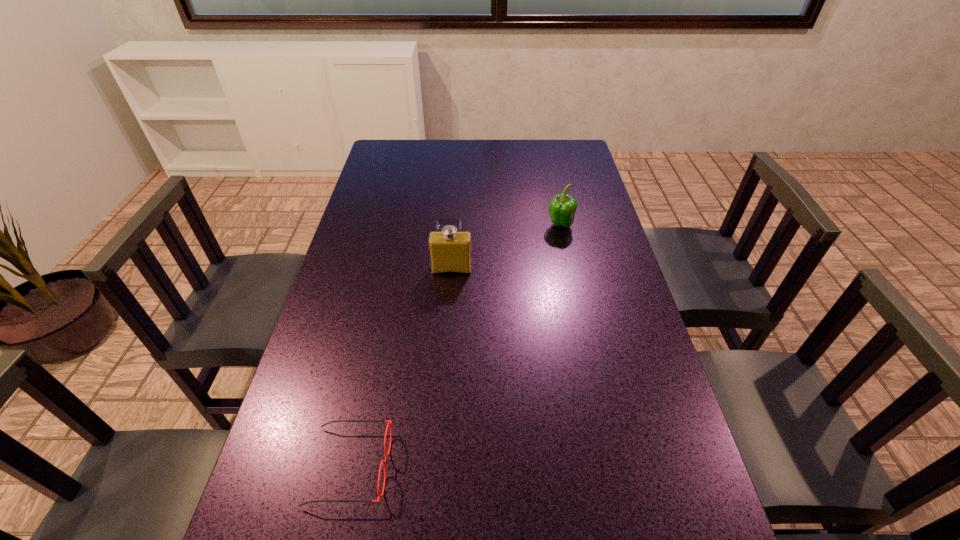
I want to click on free space between the perfume and the rightmost object, so click(x=506, y=247).

Where is `vacant area that lies between the second shortest object and the tallest object`? This screenshot has width=960, height=540. vacant area that lies between the second shortest object and the tallest object is located at coordinates (506, 247).

I want to click on vacant area that lies between the second object from right to left and the nearest object, so click(400, 368).

At what (x,y) coordinates should I click in order to perform the action: click on vacant space that is in between the tallest object and the bell pepper. Please return your answer as a coordinate pair (x, y). Looking at the image, I should click on (506, 247).

You are a GUI agent. You are given a task and a screenshot of the screen. Output one action in this format:
    pyautogui.click(x=<x>, y=<y>)
    Task: Click on the vacant region between the shortest object and the second object from left to right
    This screenshot has height=540, width=960.
    Given the screenshot: What is the action you would take?
    pyautogui.click(x=400, y=368)

Identify the location of object identified as the second closest to the second shortest object. (389, 421).

This screenshot has width=960, height=540. What are the coordinates of `the second closest object to the farthest object` in the screenshot? It's located at (389, 421).

The width and height of the screenshot is (960, 540). Find the location of `vacant space that satisfies the following two spatial constraints: 1. on the front-facing side of the perfume; 2. on the front-facing side of the leftmost object`. vacant space that satisfies the following two spatial constraints: 1. on the front-facing side of the perfume; 2. on the front-facing side of the leftmost object is located at coordinates (439, 466).

The height and width of the screenshot is (540, 960). I want to click on free space that satisfies the following two spatial constraints: 1. on the front side of the second tallest object; 2. on the front-facing side of the nearest object, so click(x=612, y=466).

At what (x,y) coordinates should I click in order to perform the action: click on free space in the image that satisfies the following two spatial constraints: 1. on the front side of the bell pepper; 2. on the front-facing side of the nearest object. Please return your answer as a coordinate pair (x, y). Looking at the image, I should click on (612, 466).